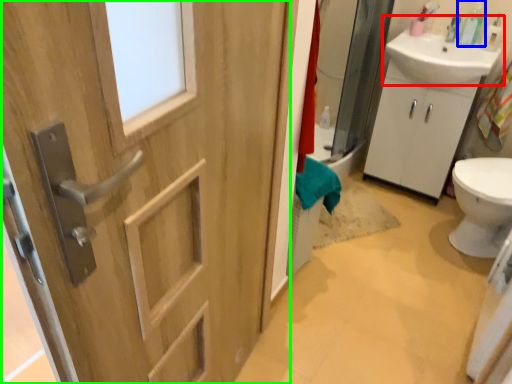
Question: Estimate the real-world distances between objects in this image. Which object is closer to sink (highlighted by a red box), soap dispenser (highlighted by a blue box) or door (highlighted by a green box)?

Choices:
 (A) soap dispenser
 (B) door

Answer: (A)